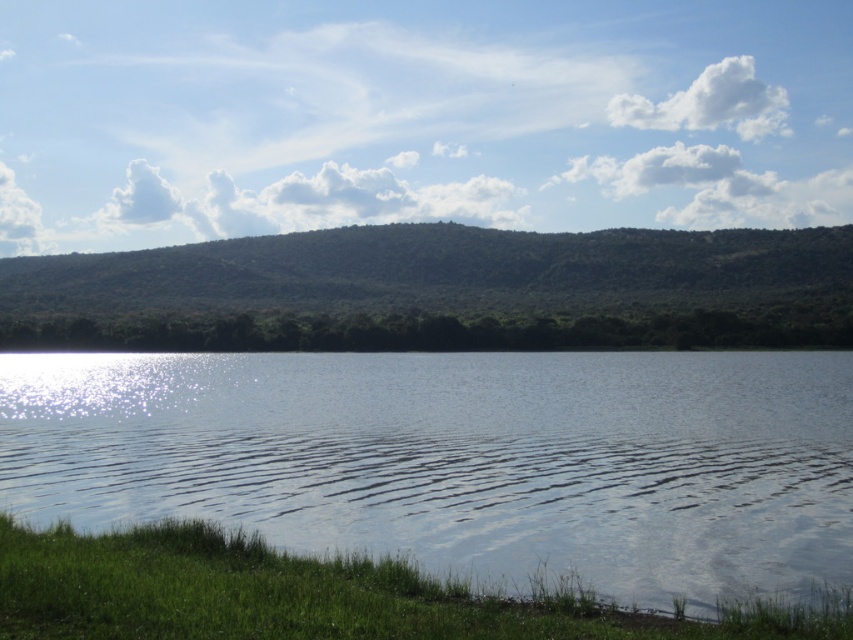
Question: Which point is farther to the camera?

Choices:
 (A) (451, 305)
 (B) (640, 481)
 (C) (144, 477)

Answer: (A)

Question: Which object is the closest to the clear water ripple at lower center?

Choices:
 (A) clear water at lower center
 (B) green leafy hill at center

Answer: (A)

Question: Where is green leafy hill at center located in relation to clear water ripple at lower center in the image?

Choices:
 (A) above
 (B) below

Answer: (A)

Question: Can you confirm if clear water at lower center is smaller than green leafy hill at center?

Choices:
 (A) yes
 (B) no

Answer: (A)

Question: Does green leafy hill at center come in front of clear water ripple at lower center?

Choices:
 (A) yes
 (B) no

Answer: (B)

Question: Which is nearer to the clear water ripple at lower center?

Choices:
 (A) clear water at lower center
 (B) green leafy hill at center

Answer: (A)